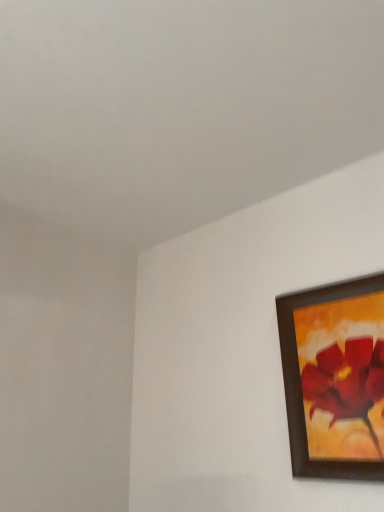
What do you see at coordinates (335, 378) in the screenshot?
I see `wooden picture frame at right` at bounding box center [335, 378].

What is the approximate height of wooden picture frame at right?

24.81 inches.

Measure the distance between point (338, 396) and camera.

Point (338, 396) and camera are 4.51 feet apart from each other.

Where is `wooden picture frame at right`? The width and height of the screenshot is (384, 512). wooden picture frame at right is located at coordinates (335, 378).

This screenshot has width=384, height=512. Identify the location of wooden picture frame at right. (335, 378).